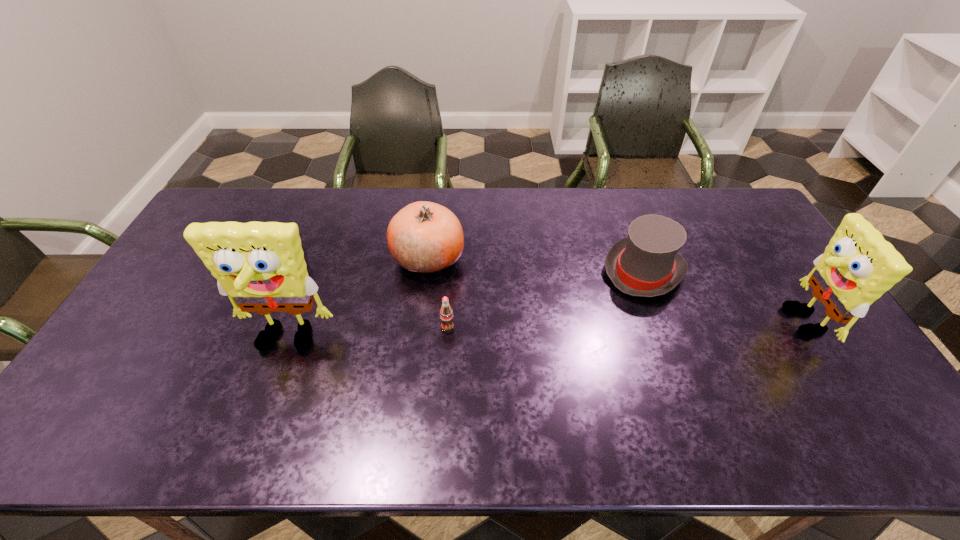
You are a GUI agent. You are given a task and a screenshot of the screen. Output one action in this format:
    pyautogui.click(x=<x>, y=<y>)
    Task: Click on the free spot between the second tallest object and the third tallest object
    The width and height of the screenshot is (960, 540).
    Given the screenshot: What is the action you would take?
    pyautogui.click(x=613, y=289)

You are a GUI agent. You are given a task and a screenshot of the screen. Output one action in this format:
    pyautogui.click(x=<x>, y=<y>)
    Task: Click on the object that stands as the closest to the pumpkin
    The height and width of the screenshot is (540, 960).
    Given the screenshot: What is the action you would take?
    pyautogui.click(x=446, y=314)

Identify the location of object that is the third closest to the fifth object from left to right. (446, 314).

What are the coordinates of `vacant space that satisfies the following two spatial constraints: 1. on the face of the shorter sponge; 2. on the face of the tallest object` in the screenshot? It's located at (812, 342).